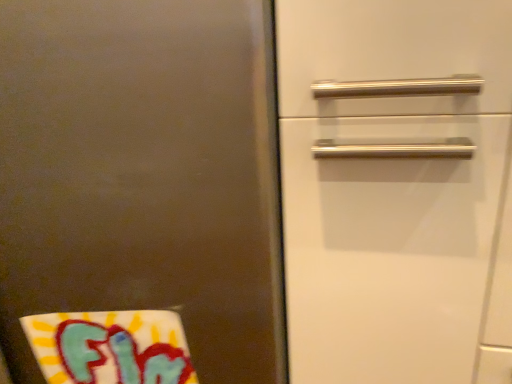
Question: Considering the positions of white fabric beach towel at lower left and brushed metal refrigerator at left in the image, is white fabric beach towel at lower left bigger or smaller than brushed metal refrigerator at left?

Choices:
 (A) small
 (B) big

Answer: (A)

Question: From the image's perspective, is white fabric beach towel at lower left positioned above or below brushed metal refrigerator at left?

Choices:
 (A) above
 (B) below

Answer: (B)

Question: Is white fabric beach towel at lower left taller or shorter than brushed metal refrigerator at left?

Choices:
 (A) tall
 (B) short

Answer: (B)

Question: Relative to white fabric beach towel at lower left, is brushed metal refrigerator at left in front or behind?

Choices:
 (A) front
 (B) behind

Answer: (A)

Question: Looking at their shapes, would you say brushed metal refrigerator at left is wider or thinner than white fabric beach towel at lower left?

Choices:
 (A) wide
 (B) thin

Answer: (A)

Question: Is brushed metal refrigerator at left situated inside white fabric beach towel at lower left or outside?

Choices:
 (A) outside
 (B) inside

Answer: (A)

Question: Is point (281, 380) positioned closer to the camera than point (130, 324)?

Choices:
 (A) farther
 (B) closer

Answer: (A)